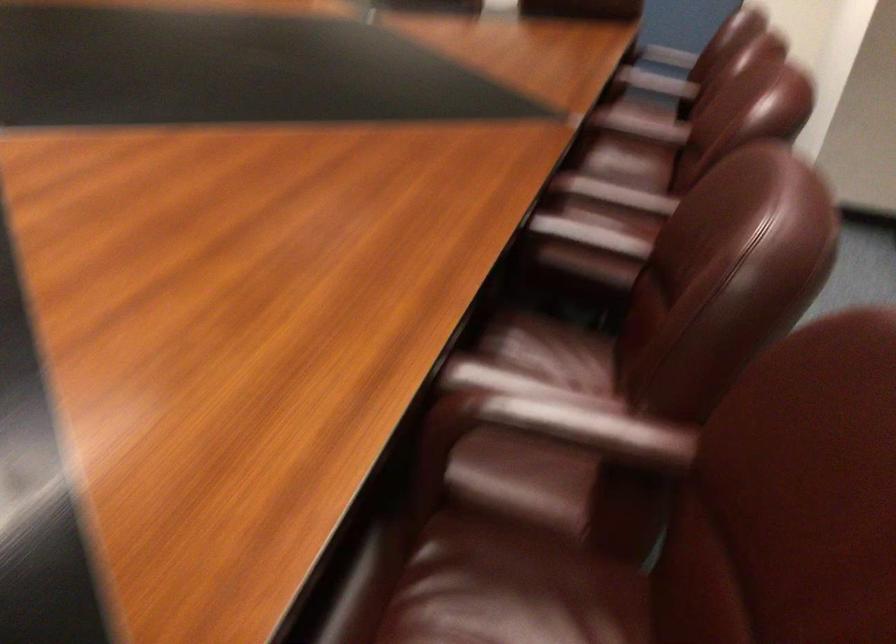
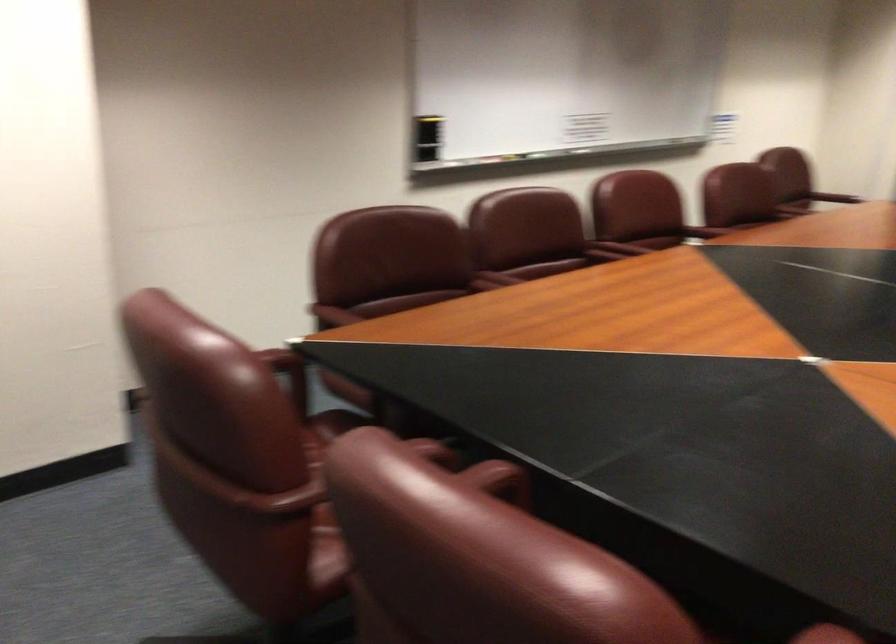
Find the pixel in the second image that matches (x=665, y=138) in the first image.

(618, 247)